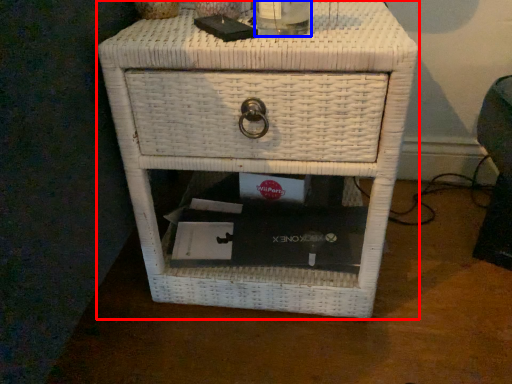
Question: Which object appears farthest to the camera in this image, nightstand (highlighted by a red box) or beverage (highlighted by a blue box)?

Choices:
 (A) nightstand
 (B) beverage

Answer: (A)